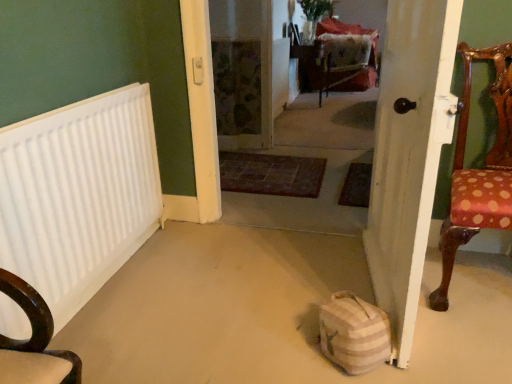
At what (x,y) coordinates should I click in order to perform the action: click on vacant space to the left of striped fabric bag at lower center. Please return your answer as a coordinate pair (x, y). Looking at the image, I should click on (288, 351).